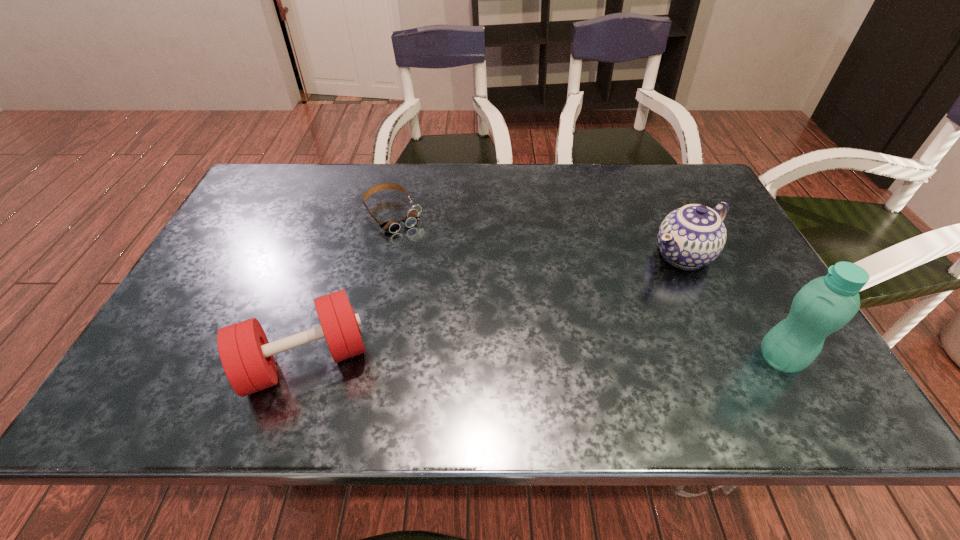
The image size is (960, 540). Identify the location of vacant area located at the spout of the chinaware. (579, 310).

This screenshot has width=960, height=540. Identify the location of vacant region located at the spout of the chinaware. (569, 315).

Where is `object located at the far edge`? The image size is (960, 540). object located at the far edge is located at coordinates (392, 226).

Locate an element on the screen. dumbbell that is at the near edge is located at coordinates (246, 355).

This screenshot has width=960, height=540. In order to click on bottle that is positioned at the near edge in this screenshot , I will do `click(826, 304)`.

Where is `bottle that is at the right edge`? The width and height of the screenshot is (960, 540). bottle that is at the right edge is located at coordinates (826, 304).

Image resolution: width=960 pixels, height=540 pixels. In order to click on chinaware that is at the right edge in this screenshot , I will do `click(692, 236)`.

In order to click on object that is positioned at the near right corner in this screenshot , I will do `click(826, 304)`.

In the image, there is a desktop. Where is `free space at the far edge`? free space at the far edge is located at coordinates (341, 198).

The width and height of the screenshot is (960, 540). In the image, there is a desktop. In order to click on vacant space at the near edge in this screenshot , I will do [x=735, y=362].